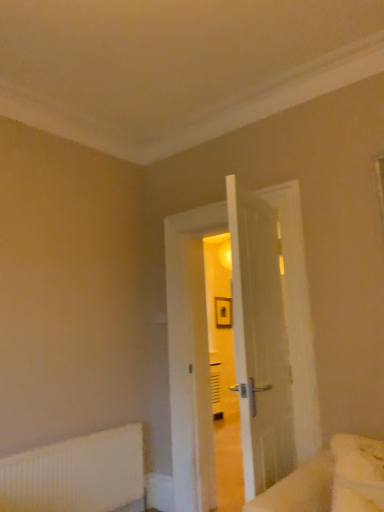
You are a GUI agent. You are given a task and a screenshot of the screen. Output one action in this format:
    pyautogui.click(x=<x>, y=<y>)
    Task: Click on the white ribbed radiator at lower left
    The image size is (384, 512).
    Given the screenshot: What is the action you would take?
    pyautogui.click(x=78, y=473)

Are white ribbed radiator at lower left and white wooden door at center located far from each other?

No, there isn't a large distance between white ribbed radiator at lower left and white wooden door at center.

Is point (128, 477) positioned behind point (290, 306)?

Yes, point (128, 477) is behind point (290, 306).

Can you confirm if white ribbed radiator at lower left is positioned to the right of white wooden door at center?

In fact, white ribbed radiator at lower left is to the left of white wooden door at center.

From the picture: Is white wooden door at center with white fluffy bed at lower right?

white wooden door at center and white fluffy bed at lower right are clearly separated.

Is white wooden door at center taller than white fluffy bed at lower right?

Indeed, white wooden door at center has a greater height compared to white fluffy bed at lower right.

Considering the positions of objects white wooden door at center and white fluffy bed at lower right in the image provided, who is behind, white wooden door at center or white fluffy bed at lower right?

white wooden door at center is behind.

Does white wooden door at center have a larger size compared to white fluffy bed at lower right?

Yes, white wooden door at center is bigger than white fluffy bed at lower right.

Does point (358, 443) come behind point (111, 455)?

That is False.

Is white fluffy bed at lower right turned away from white ribbed radiator at lower left?

white fluffy bed at lower right is not turned away from white ribbed radiator at lower left.

Is white fluffy bed at lower right not close to white ribbed radiator at lower left?

white fluffy bed at lower right is far away from white ribbed radiator at lower left.

Is white fluffy bed at lower right thinner than white ribbed radiator at lower left?

No, white fluffy bed at lower right is not thinner than white ribbed radiator at lower left.

How distant is white fluffy bed at lower right from white wooden door at center?

white fluffy bed at lower right and white wooden door at center are 4.83 feet apart.

From the image's perspective, which one is positioned higher, white fluffy bed at lower right or white wooden door at center?

white wooden door at center.

Which object is further away from the camera taking this photo, white fluffy bed at lower right or white wooden door at center?

white wooden door at center.

Which object is positioned more to the left, white fluffy bed at lower right or white wooden door at center?

From the viewer's perspective, white wooden door at center appears more on the left side.

Image resolution: width=384 pixels, height=512 pixels. In order to click on bed in front of the white ribbed radiator at lower left in this screenshot , I will do `click(330, 481)`.

From a real-world perspective, is white ribbed radiator at lower left on top of white fluffy bed at lower right?

No.

Are white ribbed radiator at lower left and white fluffy bed at lower right beside each other?

No, white ribbed radiator at lower left is not making contact with white fluffy bed at lower right.

Consider the image. Is white ribbed radiator at lower left oriented towards white fluffy bed at lower right?

Yes, white ribbed radiator at lower left is aimed at white fluffy bed at lower right.

Considering the relative positions of white wooden door at center and white ribbed radiator at lower left in the image provided, is white wooden door at center to the right of white ribbed radiator at lower left from the viewer's perspective?

Correct, you'll find white wooden door at center to the right of white ribbed radiator at lower left.

Consider the image. Is white wooden door at center wider than white ribbed radiator at lower left?

Correct, the width of white wooden door at center exceeds that of white ribbed radiator at lower left.

Would you say white wooden door at center is inside or outside white ribbed radiator at lower left?

white wooden door at center is outside white ribbed radiator at lower left.

Locate an element on the screen. The width and height of the screenshot is (384, 512). radiator lying in front of the white wooden door at center is located at coordinates (78, 473).

This screenshot has height=512, width=384. I want to click on door on the left side of white fluffy bed at lower right, so click(188, 360).

Considering their positions, is white wooden door at center positioned closer to white fluffy bed at lower right than white ribbed radiator at lower left?

white wooden door at center.

Looking at the image, which one is located further to white fluffy bed at lower right, white ribbed radiator at lower left or white wooden door at center?

white ribbed radiator at lower left.

Estimate the real-world distances between objects in this image. Which object is further from white ribbed radiator at lower left, white wooden door at center or white fluffy bed at lower right?

Among the two, white fluffy bed at lower right is located further to white ribbed radiator at lower left.

Based on their spatial positions, is white fluffy bed at lower right or white ribbed radiator at lower left closer to white wooden door at center?

white ribbed radiator at lower left.

Estimate the real-world distances between objects in this image. Which object is closer to white ribbed radiator at lower left, white fluffy bed at lower right or white wooden door at center?

white wooden door at center lies closer to white ribbed radiator at lower left than the other object.

Looking at the image, which one is located further to white wooden door at center, white ribbed radiator at lower left or white fluffy bed at lower right?

Based on the image, white fluffy bed at lower right appears to be further to white wooden door at center.

Image resolution: width=384 pixels, height=512 pixels. I want to click on door situated between white ribbed radiator at lower left and white fluffy bed at lower right from left to right, so click(x=188, y=360).